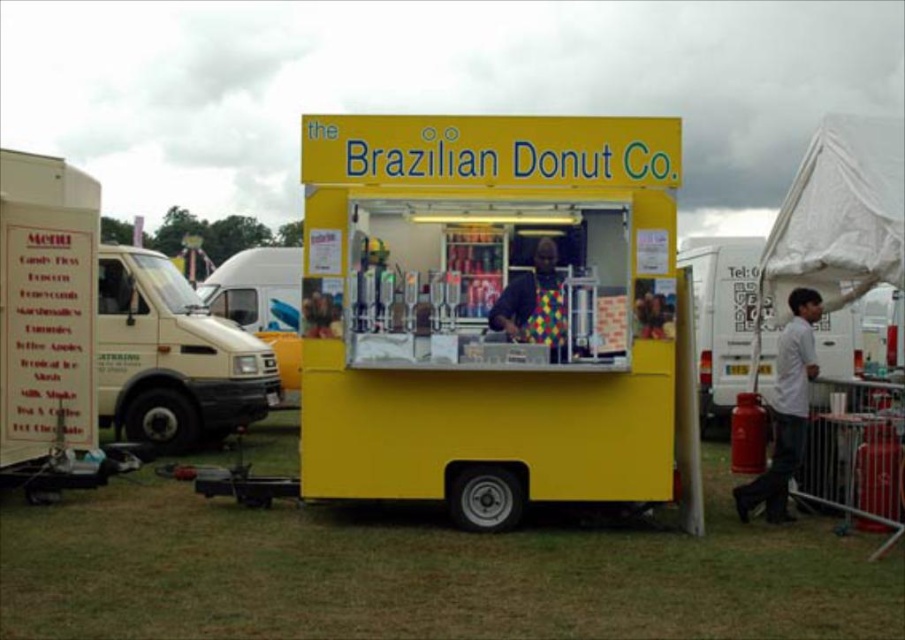
What is located at the point with coordinates (x=424, y=572)?

The point at coordinates (x=424, y=572) is occupied by green grass at lower center.

You are a delivery person who needs to place a large box between the yellow matte food truck at center and the green grass at lower center. The box requires 3 meters of space. Is there enough space between them?

The distance between the yellow matte food truck at center and the green grass at lower center is 2.93 meters, which is slightly less than the required 3 meters. Therefore, there isn not enough space to place the large box between them.

You are standing at the lower part of the image and want to walk towards the yellow matte food truck at center. Which direction should you move relative to the green grass at lower center?

The yellow matte food truck at center is located above the green grass at lower center, so you should move upward from the green grass at lower center to reach the yellow matte food truck at center.